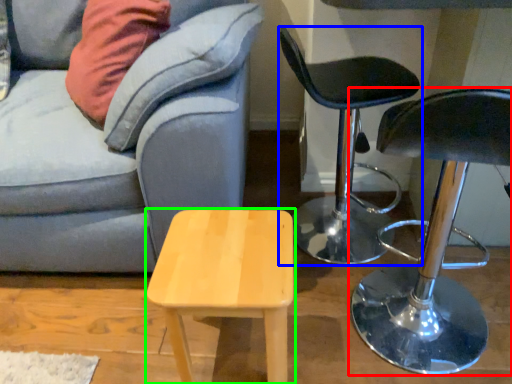
Question: Considering the real-world distances, which object is closest to chair (highlighted by a red box)? chair (highlighted by a blue box) or stool (highlighted by a green box).

Choices:
 (A) chair
 (B) stool

Answer: (A)